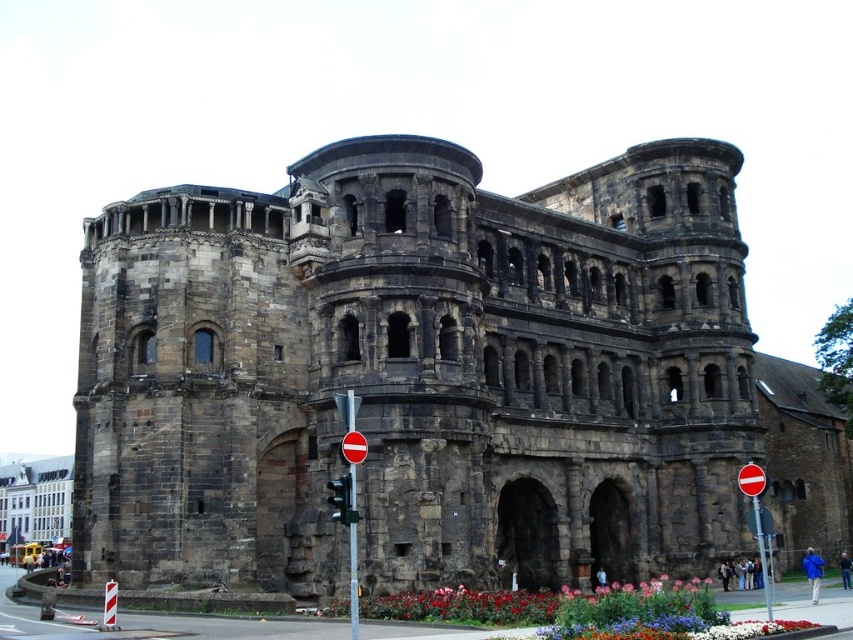
Question: Is rustic stone building at center below red glass traffic light at center?

Choices:
 (A) yes
 (B) no

Answer: (B)

Question: Is rustic stone building at center bigger than red glass traffic light at center?

Choices:
 (A) no
 (B) yes

Answer: (B)

Question: Can you confirm if rustic stone building at center is positioned to the right of red glass traffic light at center?

Choices:
 (A) no
 (B) yes

Answer: (B)

Question: Based on their relative distances, which object is farther from the rustic stone building at center?

Choices:
 (A) red plastic sign at center
 (B) red glass traffic light at center

Answer: (A)

Question: Which is nearer to the rustic stone building at center?

Choices:
 (A) red glass traffic light at center
 (B) red plastic sign at center

Answer: (A)

Question: Which point is farther from the camera taking this photo?

Choices:
 (A) (756, 524)
 (B) (341, 513)

Answer: (A)